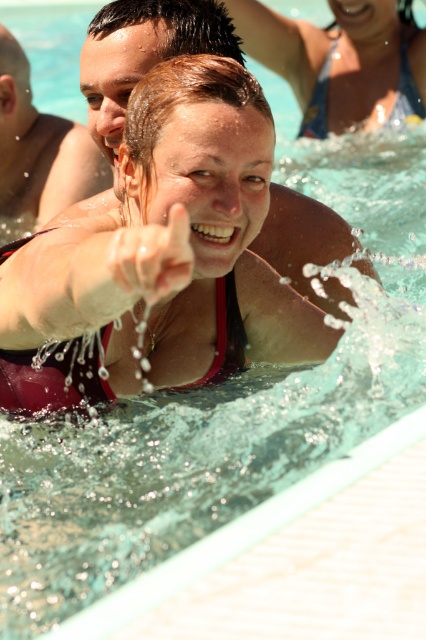
Is matte pink swimsuit at center to the left of matte pink bikini top at upper center from the viewer's perspective?

Correct, you'll find matte pink swimsuit at center to the left of matte pink bikini top at upper center.

Looking at this image, is matte pink swimsuit at center further to the viewer compared to matte pink bikini top at upper center?

No, it is not.

This screenshot has width=426, height=640. Describe the element at coordinates (158, 257) in the screenshot. I see `matte pink swimsuit at center` at that location.

I want to click on matte pink swimsuit at center, so click(x=158, y=257).

Can you confirm if matte pink bikini top at upper center is positioned above smooth skin face at upper center?

Yes.

Does point (417, 99) lie behind point (42, 209)?

Yes, point (417, 99) is behind point (42, 209).

Find the location of a particular element. This screenshot has height=640, width=426. matte pink bikini top at upper center is located at coordinates (340, 61).

Is matte pink swimsuit at center positioned in front of smooth skin face at upper center?

Yes, it is.

Who is more forward, (95, 248) or (2, 42)?

Point (95, 248)

Which is in front, point (146, 364) or point (62, 170)?

Point (146, 364)

Identify the location of matte pink swimsuit at center. (158, 257).